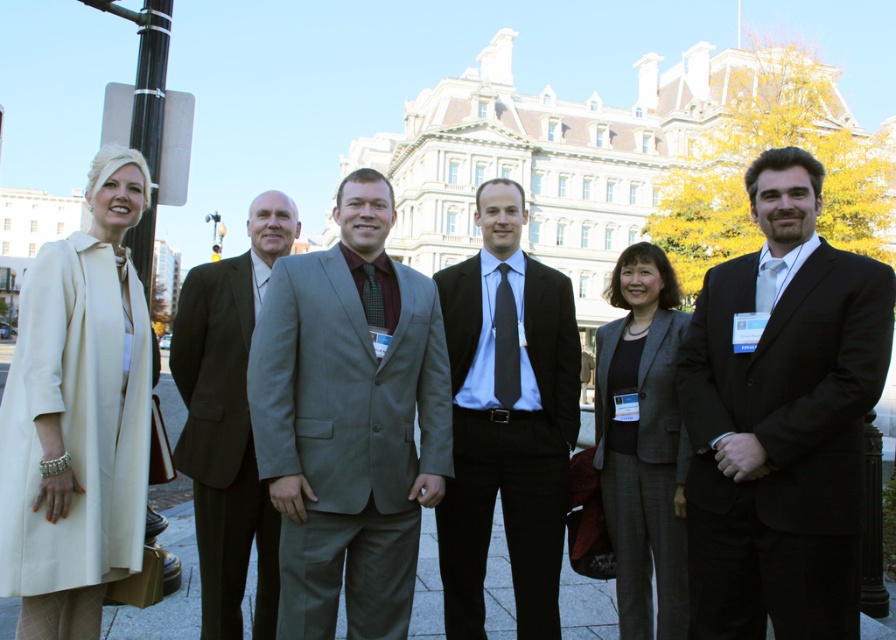
Question: Which object is the farthest from the dark brown suit at center?

Choices:
 (A) dark gray suit at center
 (B) creamy satin coat at left
 (C) black suit at center

Answer: (C)

Question: Observing the image, what is the correct spatial positioning of dark brown suit at center in reference to dark gray suit at center?

Choices:
 (A) above
 (B) below

Answer: (A)

Question: Estimate the real-world distances between objects in this image. Which object is farther from the dark brown suit at center?

Choices:
 (A) dark gray suit at center
 (B) black smooth suit at center
 (C) creamy satin coat at left
 (D) black suit at center

Answer: (D)

Question: Does gray suit at center lie in front of dark gray suit at center?

Choices:
 (A) yes
 (B) no

Answer: (A)

Question: Can you confirm if black suit at center is positioned above creamy satin coat at left?

Choices:
 (A) yes
 (B) no

Answer: (B)

Question: Which of the following is the closest to the observer?

Choices:
 (A) (662, 547)
 (B) (492, 232)
 (C) (784, 534)

Answer: (C)